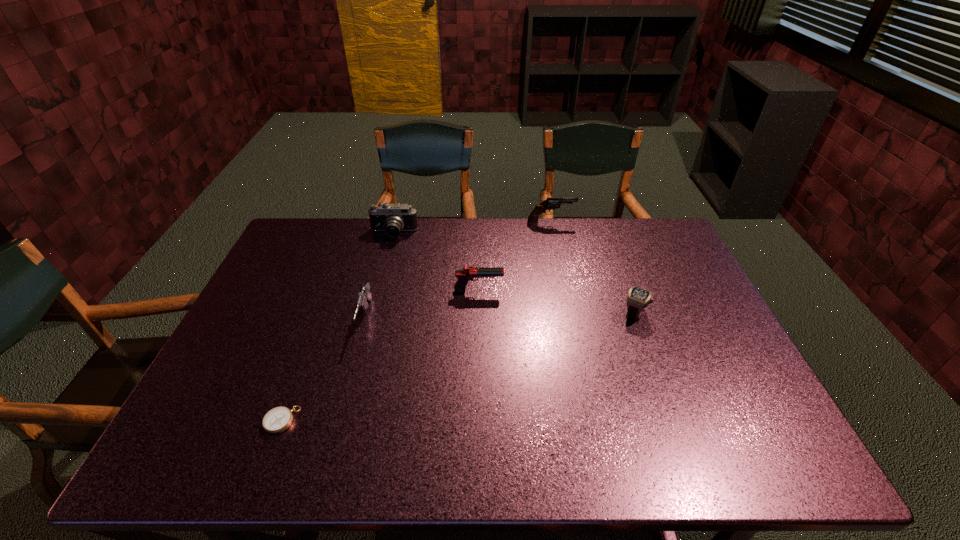
I want to click on free space located 0.290m on the front-facing side of the second farthest object, so click(x=377, y=300).

Locate an element on the screen. This screenshot has height=540, width=960. free point located at the aiming end of the second gun from left to right is located at coordinates (520, 291).

What are the coordinates of `vacant space situated 0.210m at the barrel of the nearest gun` in the screenshot? It's located at (341, 411).

Where is `free space located on the front of the rightmost object`? Image resolution: width=960 pixels, height=540 pixels. free space located on the front of the rightmost object is located at coordinates (648, 350).

Find the location of a particular element. The height and width of the screenshot is (540, 960). vacant region located on the front of the shortest object is located at coordinates (268, 457).

Locate an element on the screen. This screenshot has width=960, height=540. gun that is at the far edge is located at coordinates (550, 203).

You are a GUI agent. You are given a task and a screenshot of the screen. Output one action in this format:
    pyautogui.click(x=<x>, y=<y>)
    Task: Click on the camera present at the far edge
    This screenshot has height=540, width=960.
    Given the screenshot: What is the action you would take?
    pyautogui.click(x=392, y=218)

The height and width of the screenshot is (540, 960). What are the coordinates of `object situated at the near edge` in the screenshot? It's located at (278, 419).

The width and height of the screenshot is (960, 540). In the image, there is a desktop. Find the location of `vacant space at the far edge`. vacant space at the far edge is located at coordinates (x=475, y=225).

In order to click on vacant position at the near edge of the desktop in this screenshot , I will do `click(664, 452)`.